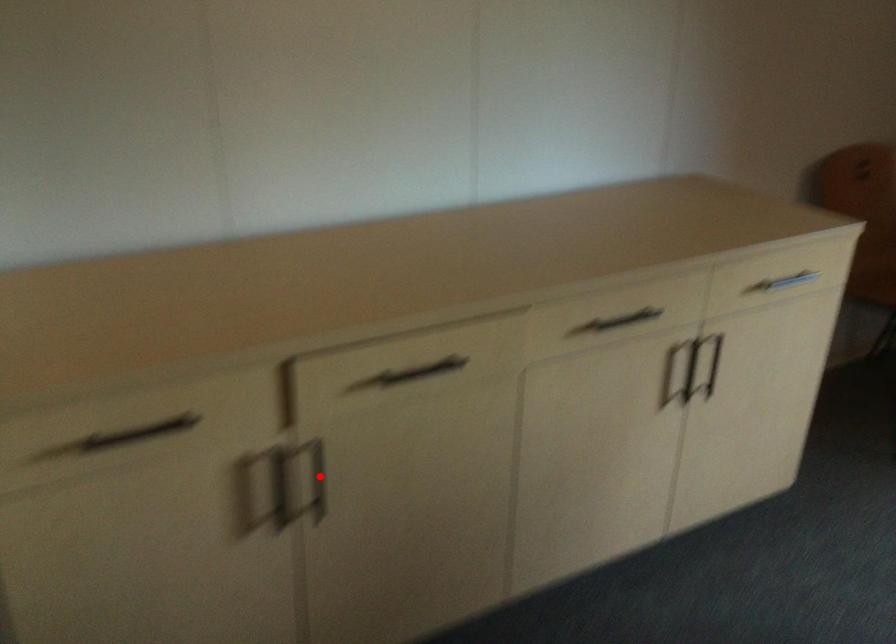
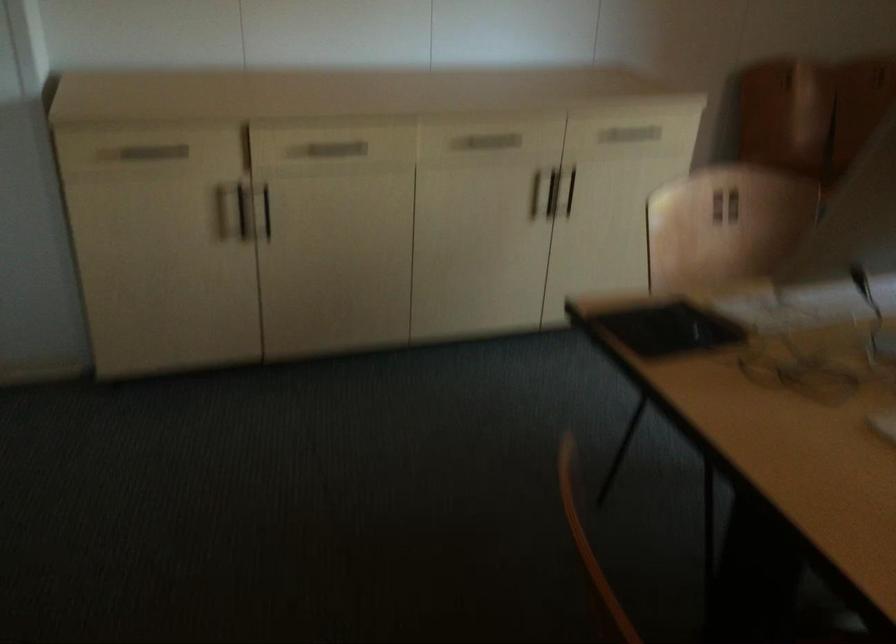
Question: I am providing you with two images of the same scene from different viewpoints. A red point is shown in image1. For the corresponding object point in image2, is it positioned nearer or farther from the camera?

Choices:
 (A) Nearer
 (B) Farther

Answer: (B)